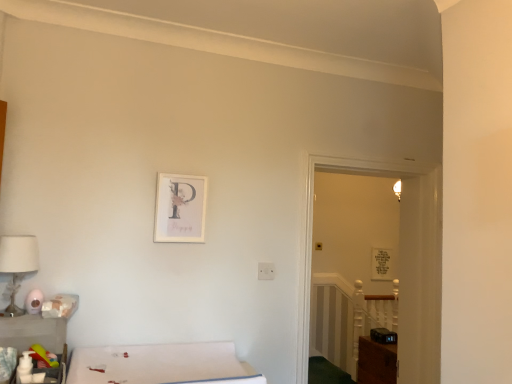
Question: Is matte plastic toiletries at lower left, the first table from the front, at the right side of white matte picture frame at upper center, placed as the second picture frame when sorted from back to front?

Choices:
 (A) no
 (B) yes

Answer: (A)

Question: Does matte plastic toiletries at lower left, arranged as the second table when viewed from the back, have a larger size compared to white matte picture frame at upper center, the 2th picture frame in the right-to-left sequence?

Choices:
 (A) no
 (B) yes

Answer: (B)

Question: Can you confirm if matte plastic toiletries at lower left, the first table from the front, is smaller than white matte picture frame at upper center, the 2th picture frame in the right-to-left sequence?

Choices:
 (A) no
 (B) yes

Answer: (A)

Question: Considering the relative sizes of matte plastic toiletries at lower left, the first table from the front, and white matte picture frame at upper center, placed as the second picture frame when sorted from back to front, in the image provided, is matte plastic toiletries at lower left, the first table from the front, wider than white matte picture frame at upper center, placed as the second picture frame when sorted from back to front,?

Choices:
 (A) yes
 (B) no

Answer: (A)

Question: Is matte plastic toiletries at lower left, arranged as the second table when viewed from the back, at the left side of white matte picture frame at upper center, the 2th picture frame when ordered from bottom to top?

Choices:
 (A) no
 (B) yes

Answer: (B)

Question: From a real-world perspective, is matte plastic toiletries at lower left, the first table from the front, on top of white matte picture frame at upper center, the 2th picture frame when ordered from bottom to top?

Choices:
 (A) yes
 (B) no

Answer: (B)

Question: Is matte white picture frame at upper center, the second picture frame from the top, positioned beyond the bounds of white fabric bed at lower left?

Choices:
 (A) yes
 (B) no

Answer: (A)

Question: From a real-world perspective, is matte white picture frame at upper center, the second picture frame from the top, located higher than white fabric bed at lower left?

Choices:
 (A) no
 (B) yes

Answer: (B)

Question: Does matte white picture frame at upper center, which ranks as the 1th picture frame in right-to-left order, turn towards white fabric bed at lower left?

Choices:
 (A) yes
 (B) no

Answer: (B)

Question: Does matte white picture frame at upper center, placed as the 1th picture frame when sorted from back to front, have a smaller size compared to white fabric bed at lower left?

Choices:
 (A) no
 (B) yes

Answer: (B)

Question: From the image's perspective, is matte white picture frame at upper center, placed as the 1th picture frame when sorted from back to front, on white fabric bed at lower left?

Choices:
 (A) yes
 (B) no

Answer: (B)

Question: Is matte white picture frame at upper center, which is the second picture frame in left-to-right order, far from white fabric bed at lower left?

Choices:
 (A) no
 (B) yes

Answer: (B)

Question: Can you confirm if matte plastic toiletries at lower left, marked as the 1th table in a back-to-front arrangement, is positioned to the right of clear glass door at center?

Choices:
 (A) no
 (B) yes

Answer: (A)